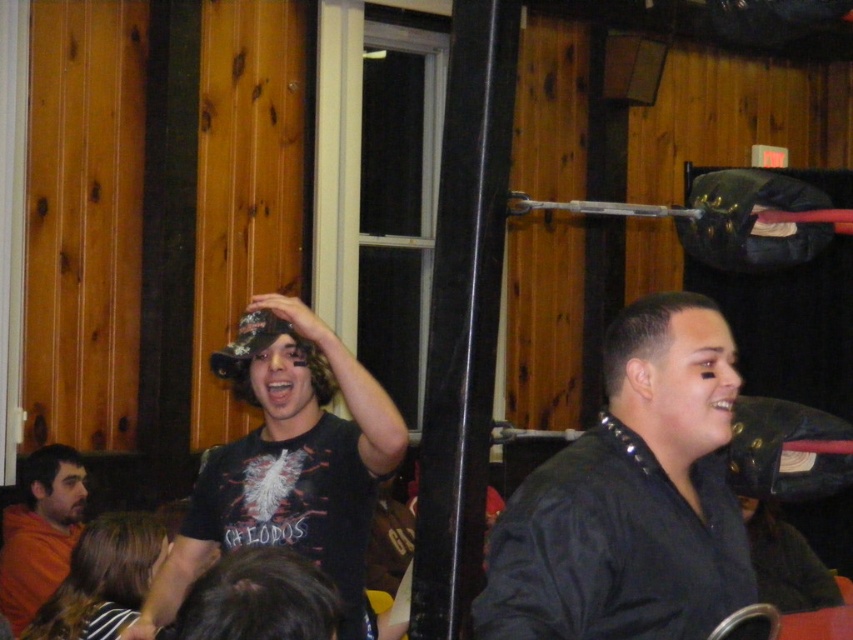
You are organizing a charity event and need to place a large poster on the wall between the black leather jacket at center and the orange cotton shirt at lower left. Which object should the poster be closer to to ensure it doesn

The poster should be placed closer to the black leather jacket at center because it has a larger size compared to the orange cotton shirt at lower left, making it more visually prominent.

You are standing at the entrance of the gymnasium and see the black leather jacket at center and the orange cotton shirt at lower left. Which one is closer to the right side of the gymnasium?

The black leather jacket at center is closer to the right side of the gymnasium because it is positioned to the right of the orange cotton shirt at lower left.

From the picture: You are organizing a photo shoot and need to ensure that props match the scene. The black matte cap at center and orange cotton shirt at lower left are part of the props. Given their sizes, which prop would require more storage space?

The black matte cap at center is bigger than the orange cotton shirt at lower left, so it would require more storage space.